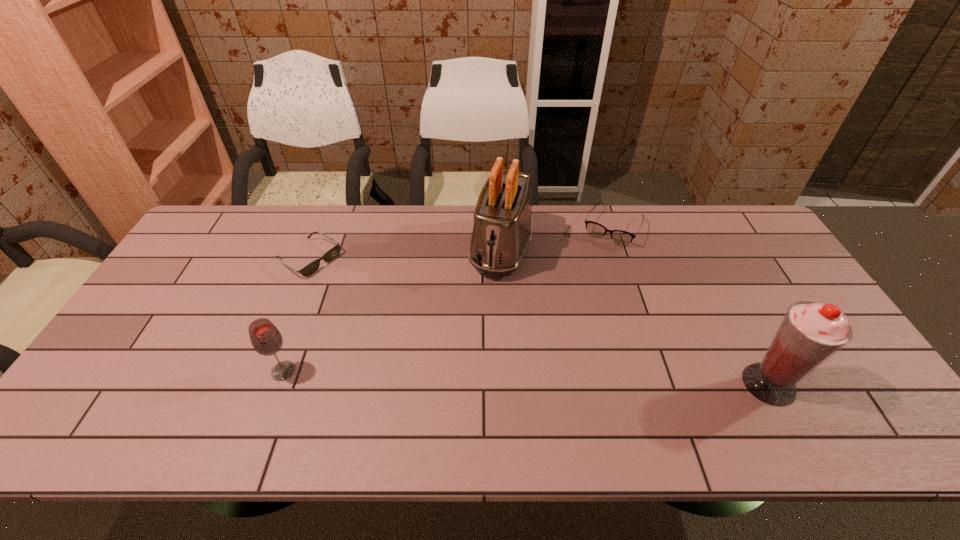
Where is `the third shortest object`? This screenshot has width=960, height=540. the third shortest object is located at coordinates (266, 339).

In order to click on the rightmost object in this screenshot , I will do `click(810, 333)`.

Identify the location of the third object from left to right. (502, 228).

Find the location of a particular element. The height and width of the screenshot is (540, 960). the fourth tallest object is located at coordinates pos(594,229).

Image resolution: width=960 pixels, height=540 pixels. Identify the location of spectacles. (594, 229).

At what (x,y) coordinates should I click in order to perform the action: click on the shortest object. Please return your answer as a coordinate pair (x, y). This screenshot has height=540, width=960. Looking at the image, I should click on (333, 252).

Locate an element on the screen. This screenshot has height=540, width=960. vacant area located on the right of the third shortest object is located at coordinates coord(352,371).

You are a GUI agent. You are given a task and a screenshot of the screen. Output one action in this format:
    pyautogui.click(x=<x>, y=<y>)
    Task: Click on the blank space located on the left of the smoothie
    The height and width of the screenshot is (540, 960).
    Given the screenshot: What is the action you would take?
    pyautogui.click(x=645, y=384)

You are a GUI agent. You are given a task and a screenshot of the screen. Output one action in this format:
    pyautogui.click(x=<x>, y=<y>)
    Task: Click on the free point located on the side of the third object from right to left with the control lever
    
    Given the screenshot: What is the action you would take?
    pyautogui.click(x=458, y=392)

The width and height of the screenshot is (960, 540). Identify the location of vacant space located on the side of the third object from right to left with the control lever. (476, 337).